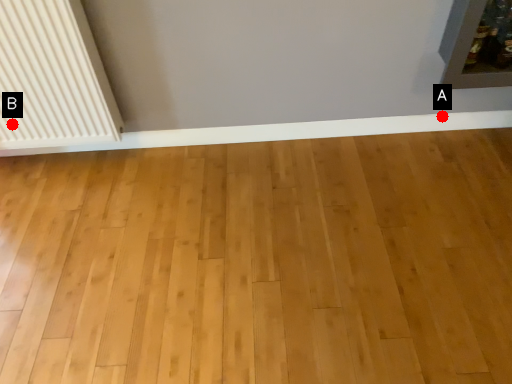
Question: Two points are circled on the image, labeled by A and B beside each circle. Which point is further to the camera?

Choices:
 (A) A is further
 (B) B is further

Answer: (A)